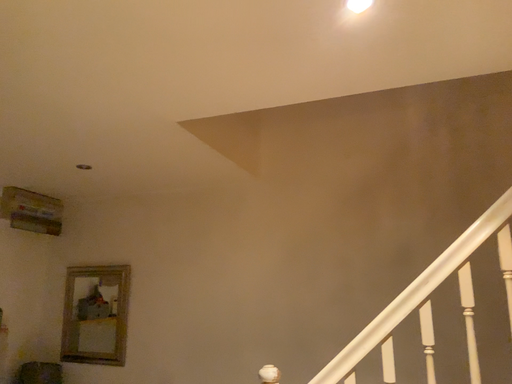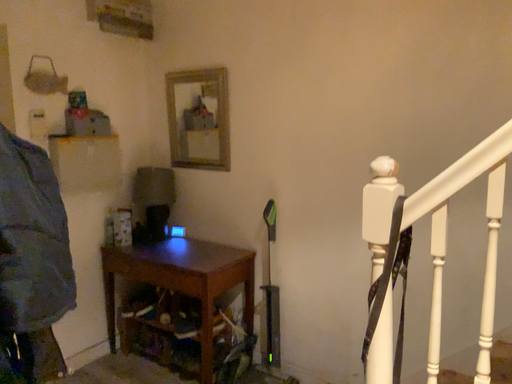
Question: How did the camera likely rotate when shooting the video?

Choices:
 (A) rotated left
 (B) rotated right

Answer: (A)